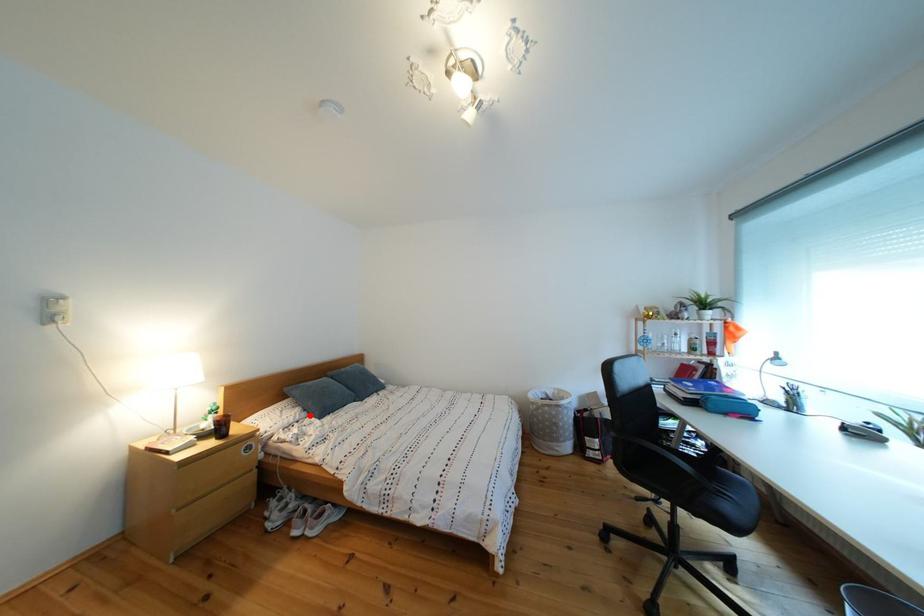
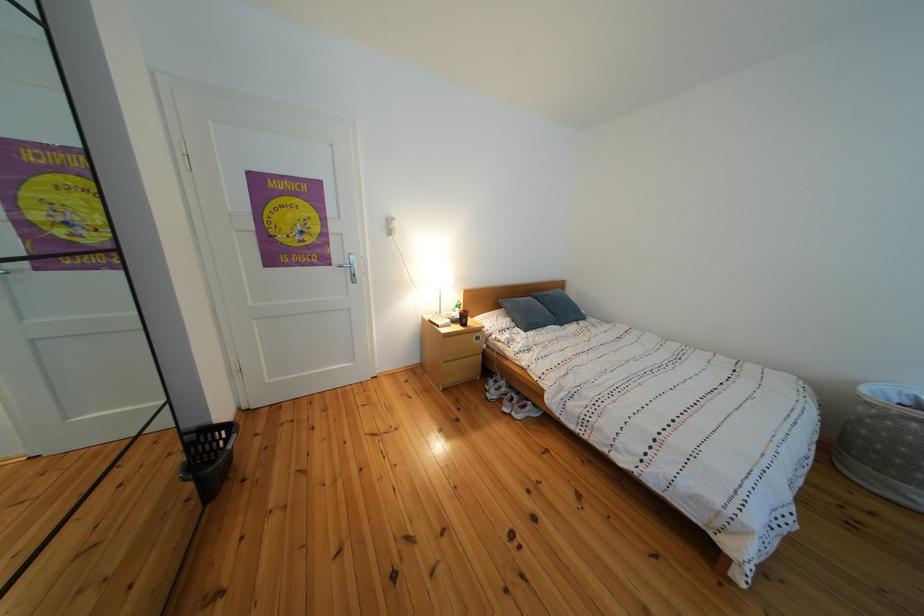
In the second image, find the point that corresponds to the highlighted location in the first image.

(519, 325)